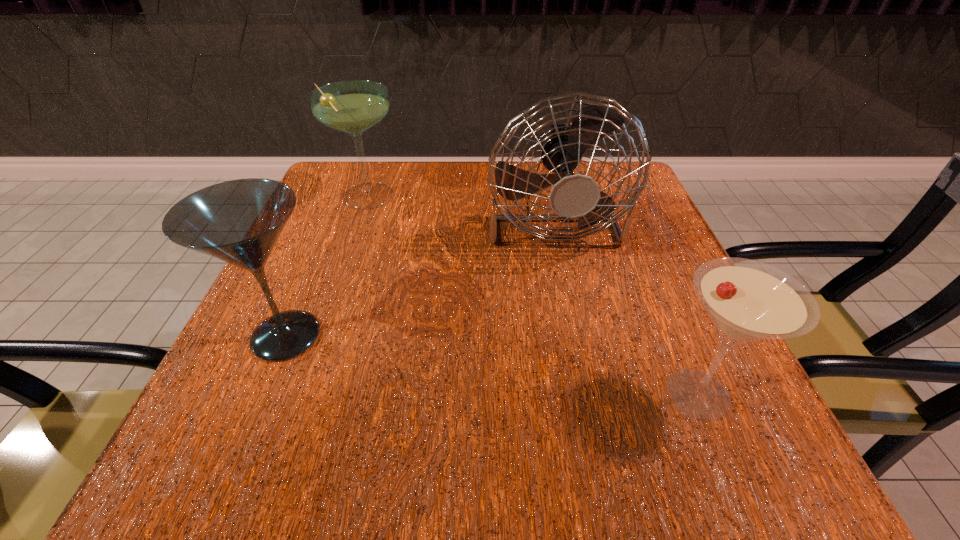
You are a GUI agent. You are given a task and a screenshot of the screen. Output one action in this format:
    pyautogui.click(x=<x>, y=<y>)
    Task: Click on the vacant space at the far right corner of the desktop
    
    Given the screenshot: What is the action you would take?
    pyautogui.click(x=653, y=213)

In the image, there is a desktop. Where is `free space at the near right corner`? This screenshot has height=540, width=960. free space at the near right corner is located at coordinates (685, 467).

At what (x,y) coordinates should I click in order to perform the action: click on empty space that is in between the tallest object and the rightmost martini. Please return your answer as a coordinate pair (x, y). The height and width of the screenshot is (540, 960). Looking at the image, I should click on (624, 305).

Locate an element on the screen. The height and width of the screenshot is (540, 960). blank region between the fan and the shortest object is located at coordinates (624, 305).

Locate an element on the screen. Image resolution: width=960 pixels, height=540 pixels. blank region between the tallest object and the shortest martini is located at coordinates (624, 305).

The width and height of the screenshot is (960, 540). Find the location of `free space between the farthest martini and the tallest object`. free space between the farthest martini and the tallest object is located at coordinates (458, 206).

The width and height of the screenshot is (960, 540). I want to click on blank region between the farthest martini and the fan, so [458, 206].

Identify the location of vacant area that lies between the farthest martini and the shortest object. (532, 296).

I want to click on free space between the tallest object and the farthest martini, so click(x=458, y=206).

The width and height of the screenshot is (960, 540). Identify the location of vacant space in between the fan and the farthest martini. (458, 206).